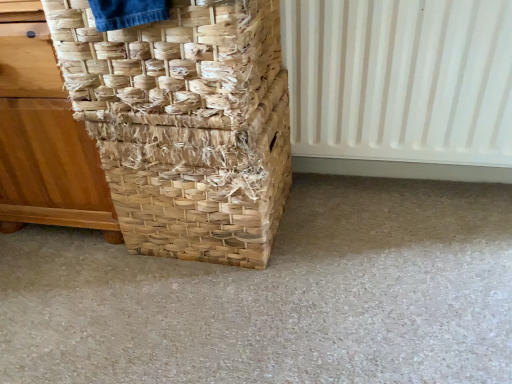
Question: Considering the relative positions of natural woven basket at left and natural woven basket at center, which ranks as the second basket in top-to-bottom order, in the image provided, is natural woven basket at left to the right of natural woven basket at center, which ranks as the second basket in top-to-bottom order, from the viewer's perspective?

Choices:
 (A) no
 (B) yes

Answer: (A)

Question: Would you say natural woven basket at left is a long distance from natural woven basket at center, which ranks as the second basket in top-to-bottom order?

Choices:
 (A) yes
 (B) no

Answer: (B)

Question: From the image's perspective, is natural woven basket at left located beneath natural woven basket at center, the first basket ordered from the bottom?

Choices:
 (A) no
 (B) yes

Answer: (A)

Question: Can you confirm if natural woven basket at left is wider than natural woven basket at center, the first basket ordered from the bottom?

Choices:
 (A) no
 (B) yes

Answer: (B)

Question: Is natural woven basket at left closer to camera compared to natural woven basket at center, which ranks as the second basket in top-to-bottom order?

Choices:
 (A) yes
 (B) no

Answer: (A)

Question: Considering the positions of natural woven basket at left and natural woven basket at center, the first basket ordered from the bottom, in the image, is natural woven basket at left bigger or smaller than natural woven basket at center, the first basket ordered from the bottom,?

Choices:
 (A) small
 (B) big

Answer: (B)

Question: Does point (14, 223) appear closer or farther from the camera than point (258, 115)?

Choices:
 (A) farther
 (B) closer

Answer: (A)

Question: From the image's perspective, is natural woven basket at left positioned above or below natural woven basket at center, which ranks as the second basket in top-to-bottom order?

Choices:
 (A) above
 (B) below

Answer: (A)

Question: In terms of width, does natural woven basket at left look wider or thinner when compared to natural woven basket at center, the first basket ordered from the bottom?

Choices:
 (A) wide
 (B) thin

Answer: (A)

Question: Is natural woven basket at left, the 2th basket when ordered from bottom to top, inside or outside of natural woven basket at center, the first basket ordered from the bottom?

Choices:
 (A) inside
 (B) outside

Answer: (B)

Question: Is natural woven basket at left, the 2th basket when ordered from bottom to top, taller or shorter than natural woven basket at center, the first basket ordered from the bottom?

Choices:
 (A) tall
 (B) short

Answer: (B)

Question: Based on their sizes in the image, would you say natural woven basket at left, the 2th basket when ordered from bottom to top, is bigger or smaller than natural woven basket at center, the first basket ordered from the bottom?

Choices:
 (A) big
 (B) small

Answer: (B)

Question: From the image's perspective, is natural woven basket at left, the 2th basket when ordered from bottom to top, above or below natural woven basket at center, the first basket ordered from the bottom?

Choices:
 (A) above
 (B) below

Answer: (A)

Question: Based on their sizes in the image, would you say natural woven basket at left, positioned as the 1th basket in top-to-bottom order, is bigger or smaller than white plastic radiator at right?

Choices:
 (A) small
 (B) big

Answer: (B)

Question: Relative to white plastic radiator at right, is natural woven basket at left, the 2th basket when ordered from bottom to top, in front or behind?

Choices:
 (A) front
 (B) behind

Answer: (A)